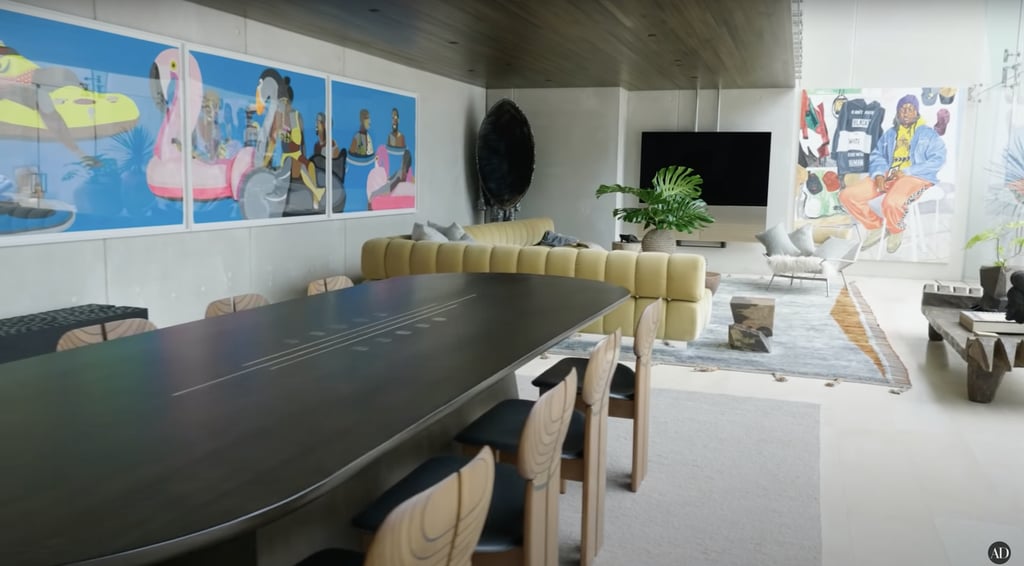
I want to click on flat screen tv, so click(x=730, y=175).